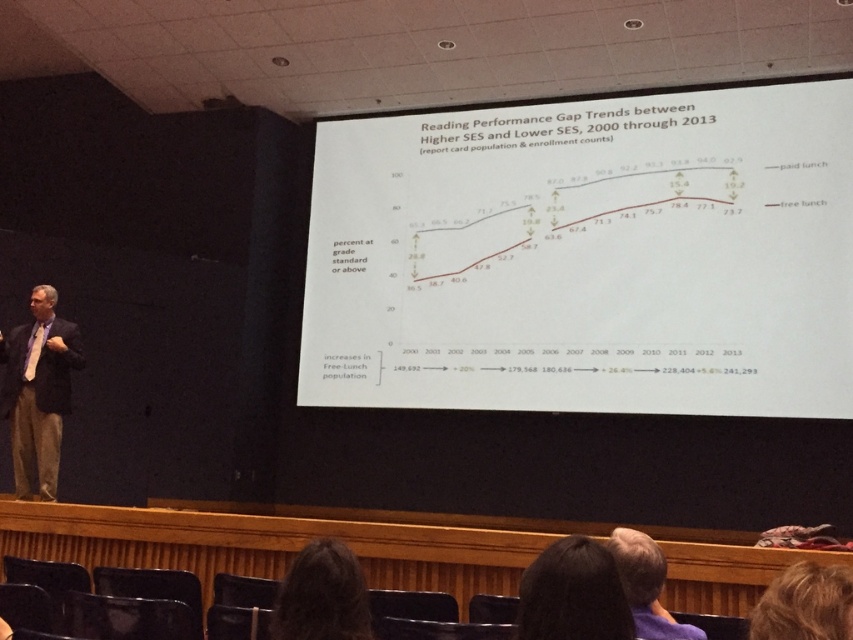
Can you confirm if matte black suit at left is wider than dark hair at lower center?

Yes.

Locate an element on the screen. matte black suit at left is located at coordinates (38, 390).

Between white paper at center and gray hair at upper center, which one appears on the left side from the viewer's perspective?

From the viewer's perspective, gray hair at upper center appears more on the left side.

Is white paper at center behind gray hair at upper center?

Yes, it is behind gray hair at upper center.

Find the location of a particular element. The width and height of the screenshot is (853, 640). white paper at center is located at coordinates (587, 257).

Between matte black suit at left and blonde hair at upper right, which one appears on the left side from the viewer's perspective?

From the viewer's perspective, matte black suit at left appears more on the left side.

Which is in front, point (7, 392) or point (802, 624)?

Point (802, 624) is in front.

Find the location of a particular element. The image size is (853, 640). matte black suit at left is located at coordinates (38, 390).